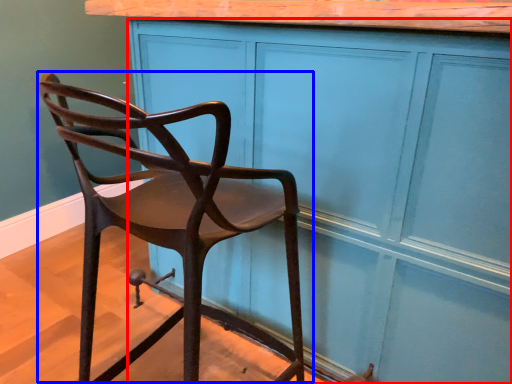
Question: Which object appears closest to the camera in this image, cabinetry (highlighted by a red box) or chair (highlighted by a blue box)?

Choices:
 (A) cabinetry
 (B) chair

Answer: (B)